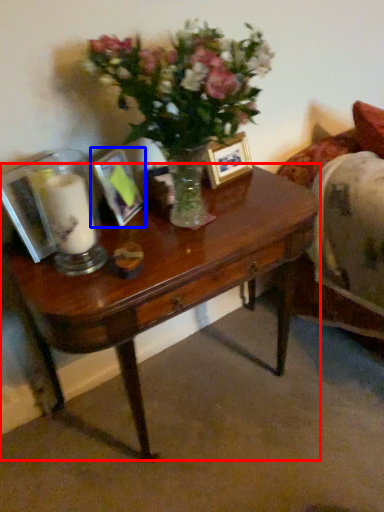
Question: Which object is further to the camera taking this photo, desk (highlighted by a red box) or picture frame (highlighted by a blue box)?

Choices:
 (A) desk
 (B) picture frame

Answer: (B)